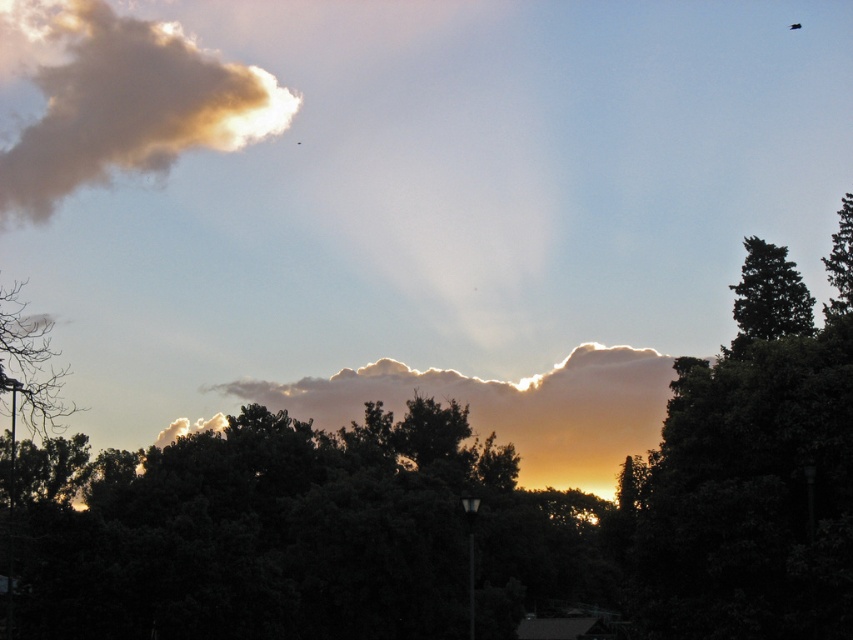
Is point (25, 589) farther from camera compared to point (837, 241)?

No, it is not.

Is green leafy tree at center above green leafy tree at right?

No, green leafy tree at center is not above green leafy tree at right.

Find the location of `green leafy tree at center`. green leafy tree at center is located at coordinates (456, 522).

At what (x,y) coordinates should I click in order to perform the action: click on green leafy tree at center. Please return your answer as a coordinate pair (x, y). The height and width of the screenshot is (640, 853). Looking at the image, I should click on (456, 522).

Which is in front, point (648, 518) or point (109, 113)?

Point (648, 518) is more forward.

Who is taller, green leafy tree at center or golden textured cloud at upper left?

Standing taller between the two is golden textured cloud at upper left.

Is point (532, 538) positioned after point (73, 80)?

That is False.

Find the location of `green leafy tree at center`. green leafy tree at center is located at coordinates (456, 522).

Can you confirm if bare branches at left is positioned to the left of green textured tree at right?

Correct, you'll find bare branches at left to the left of green textured tree at right.

Can you confirm if bare branches at left is positioned to the right of green textured tree at right?

Incorrect, bare branches at left is not on the right side of green textured tree at right.

Is point (13, 364) closer to camera compared to point (740, 348)?

Yes.

Identify the location of bare branches at left. This screenshot has height=640, width=853. (28, 364).